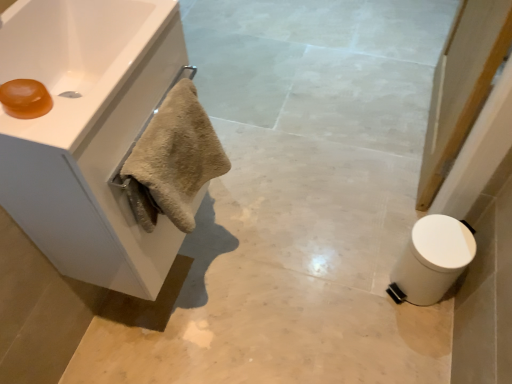
Where is `free space in front of white matte trash can at lower right`? The image size is (512, 384). free space in front of white matte trash can at lower right is located at coordinates (413, 340).